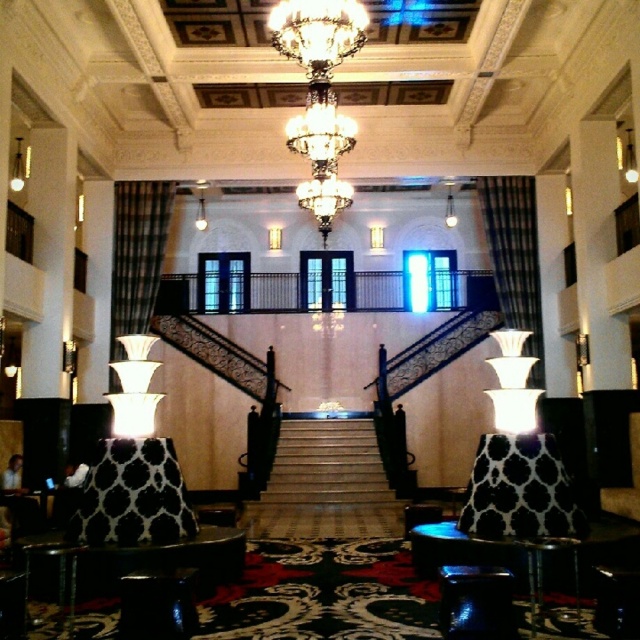
Question: Among these points, which one is nearest to the camera?

Choices:
 (A) (288, 13)
 (B) (170, 340)
 (C) (380, 349)
 (D) (344, 465)

Answer: (A)

Question: In this image, where is white marble stairs at center located relative to dark wood staircase at center?

Choices:
 (A) below
 (B) above

Answer: (A)

Question: Does white marble stairs at center appear under black wrought iron staircase at center?

Choices:
 (A) no
 (B) yes

Answer: (B)

Question: In this image, where is white marble stairs at center located relative to black wrought iron staircase at center?

Choices:
 (A) left
 (B) right

Answer: (A)

Question: Among these objects, which one is farthest from the camera?

Choices:
 (A) black wrought iron staircase at center
 (B) crystal glass chandelier at center
 (C) white marble stairs at center
 (D) dark wood staircase at center

Answer: (D)

Question: Among these objects, which one is nearest to the camera?

Choices:
 (A) dark wood staircase at center
 (B) crystal glass chandelier at center
 (C) white marble stairs at center
 (D) black wrought iron staircase at center

Answer: (B)